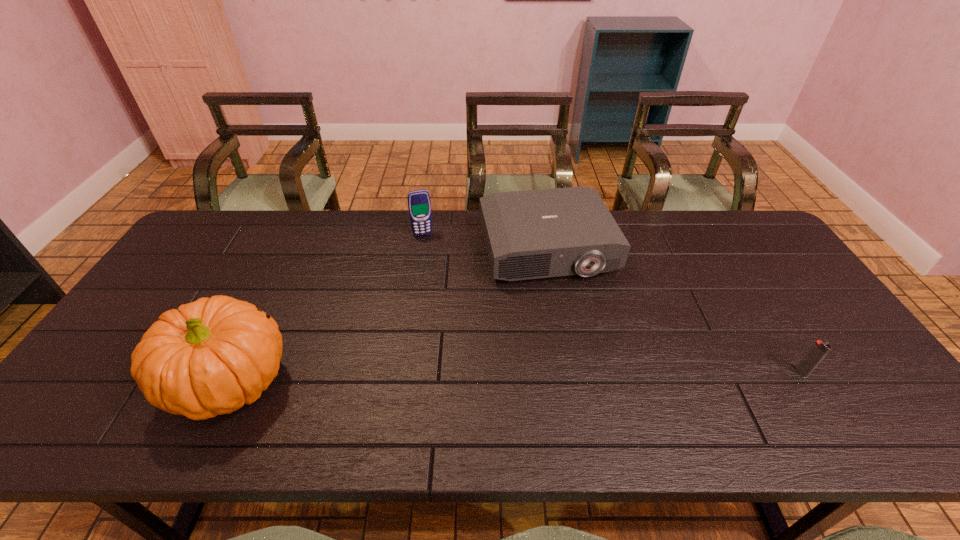
This screenshot has height=540, width=960. I want to click on blank area located on the front-facing side of the cellular telephone, so click(444, 306).

Where is `free space located on the front-facing side of the third object from left to right`? The height and width of the screenshot is (540, 960). free space located on the front-facing side of the third object from left to right is located at coordinates (569, 304).

Where is `vacant space located 0.360m on the front-facing side of the third object from left to right`? vacant space located 0.360m on the front-facing side of the third object from left to right is located at coordinates (605, 393).

This screenshot has width=960, height=540. I want to click on free space located 0.120m on the front-facing side of the third object from left to right, so click(x=575, y=317).

Find the location of a particular element. This screenshot has height=540, width=960. cellular telephone positioned at the far edge is located at coordinates (419, 205).

Locate an element on the screen. This screenshot has width=960, height=540. projector that is positioned at the far edge is located at coordinates (532, 234).

Where is `pumpkin situated at the near edge`? This screenshot has height=540, width=960. pumpkin situated at the near edge is located at coordinates (212, 356).

At what (x,y) coordinates should I click in order to perform the action: click on igniter that is positioned at the near edge. Please return your answer as a coordinate pair (x, y). The width and height of the screenshot is (960, 540). Looking at the image, I should click on (819, 350).

Locate an element on the screen. object that is at the right edge is located at coordinates (819, 350).

Where is `object at the near right corner`? object at the near right corner is located at coordinates (819, 350).